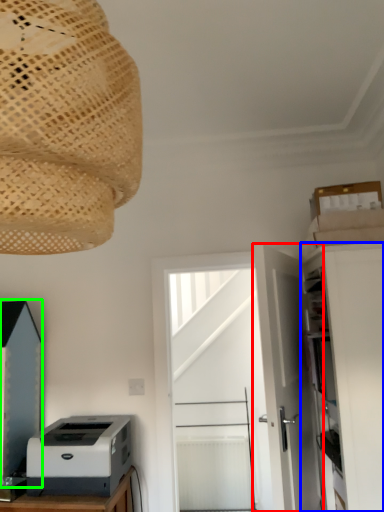
Question: Which object is positioned farthest from door (highlighted by a red box)? Select from cabinetry (highlighted by a blue box) and cabinetry (highlighted by a green box).

Choices:
 (A) cabinetry
 (B) cabinetry

Answer: (B)